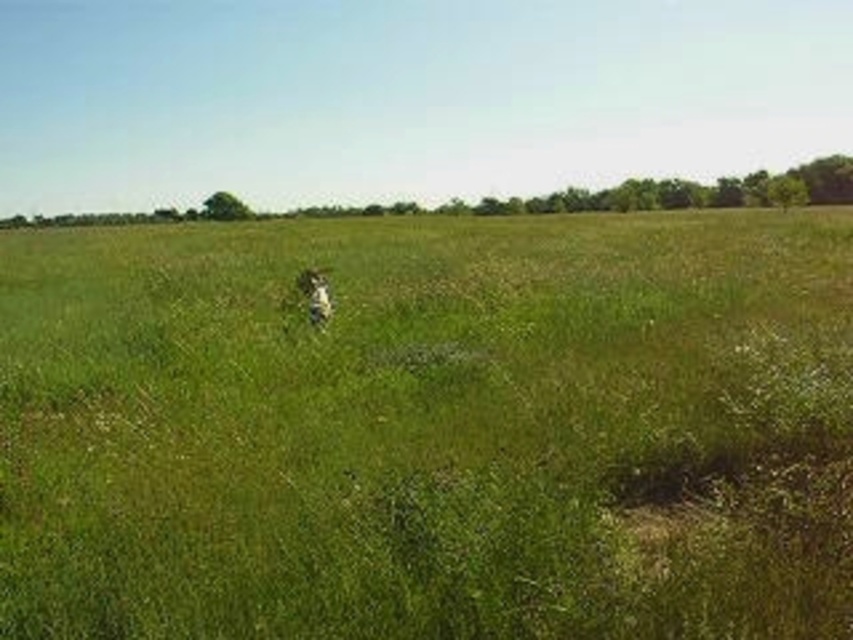
Can you confirm if green grassy pasture at center is positioned above white fur dog at center?

Yes, green grassy pasture at center is above white fur dog at center.

Can you confirm if green grassy pasture at center is bigger than white fur dog at center?

Correct, green grassy pasture at center is larger in size than white fur dog at center.

The width and height of the screenshot is (853, 640). Find the location of `green grassy pasture at center`. green grassy pasture at center is located at coordinates (428, 428).